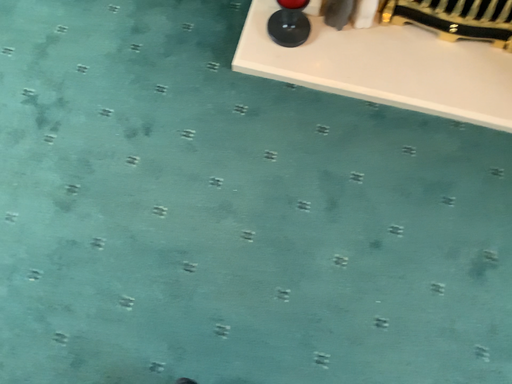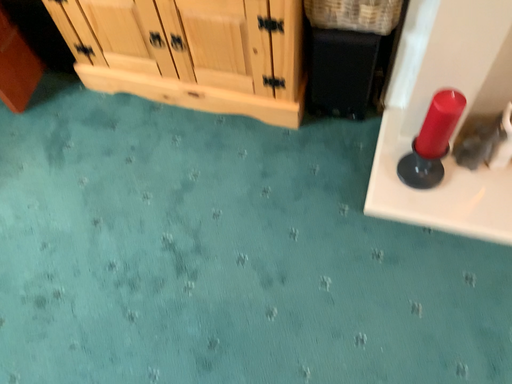
Question: Which way did the camera rotate in the video?

Choices:
 (A) rotated right
 (B) rotated left

Answer: (B)